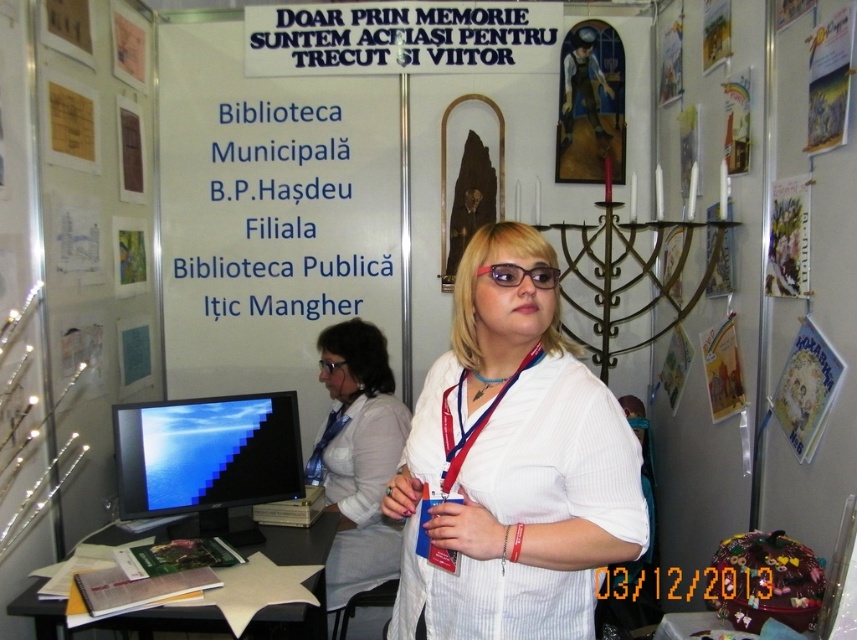
You are a photographer trying to capture a clear shot of the white matte shirt at center and the transparent plastic glasses at center. Since the glasses are see through, you need to ensure they are positioned so their reflection doesn not interfere with the subject. Given their size difference, which object should be placed closer to the camera to minimize reflection issues?

The transparent plastic glasses at center should be placed closer to the camera because the white matte shirt at center is larger in size, allowing the glasses to be positioned nearer to reduce reflections without overlapping the shirt in the frame.

Based on the photo, you are trying to determine the relative sizes of objects in the scene. Given that the matte black monitor at lower left and the white fabric shirt at center are both visible, which one has a greater height?

The white fabric shirt at center has a greater height than the matte black monitor at lower left because the matte black monitor at lower left is not as tall as the white fabric shirt at center.